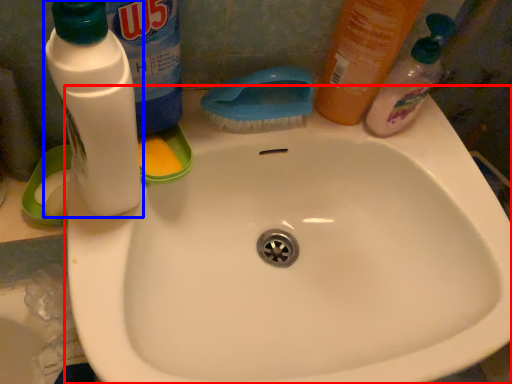
Question: Which of the following is the closest to the observer, sink (highlighted by a red box) or bottle (highlighted by a blue box)?

Choices:
 (A) sink
 (B) bottle

Answer: (B)